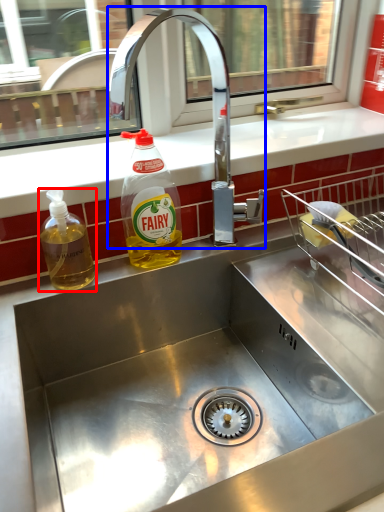
Question: Which object is further to the camera taking this photo, bottle (highlighted by a red box) or tap (highlighted by a blue box)?

Choices:
 (A) bottle
 (B) tap

Answer: (A)